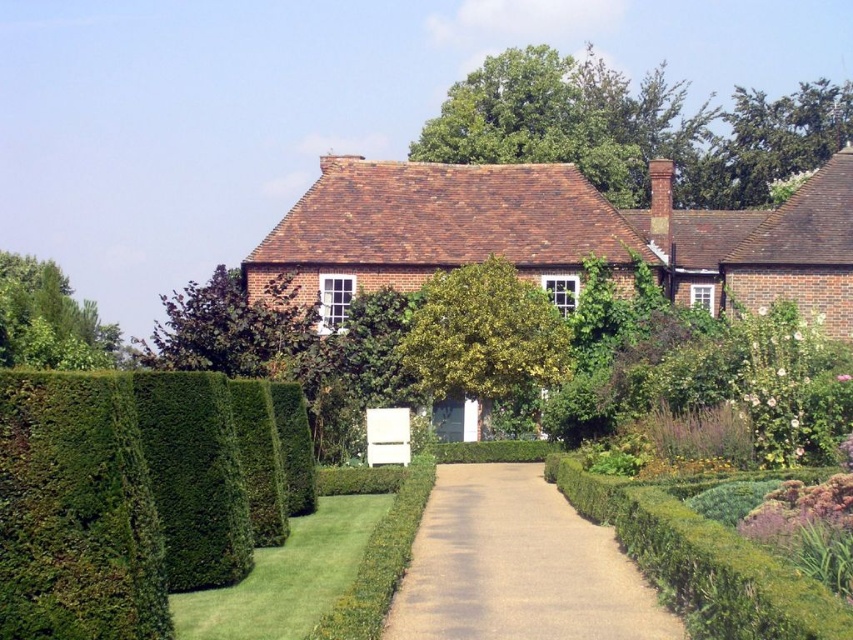
You are standing at the entrance of the traditional brick house and want to walk to the point marked as point (193,365). However, there is a hedge between you and point (610,106). Which point should you go around first to reach your destination?

You should go around point (610,106) first because it is closer to you than point (193,365), so you need to navigate around it before proceeding to your destination.

You are a gardener planning to plant a new tree in the garden. You want to ensure that the new tree does not block the view of the house from the garden pathway. Which of the two existing trees, the green leafy tree at upper center or the green leafy tree at center, should you consider removing to maintain an unobstructed view?

The green leafy tree at upper center has a greater height compared to the green leafy tree at center, so removing it would better maintain an unobstructed view of the house from the garden pathway.

You are standing at the entrance of the house and want to take a photo of the green leafy tree at upper center. If you look straight ahead, will the tree be in your line of sight?

The green leafy tree at upper center is located at point (634, 129), which is within the central area of the scene. Since you are facing the entrance, the tree would be in your line of sight when looking straight ahead.